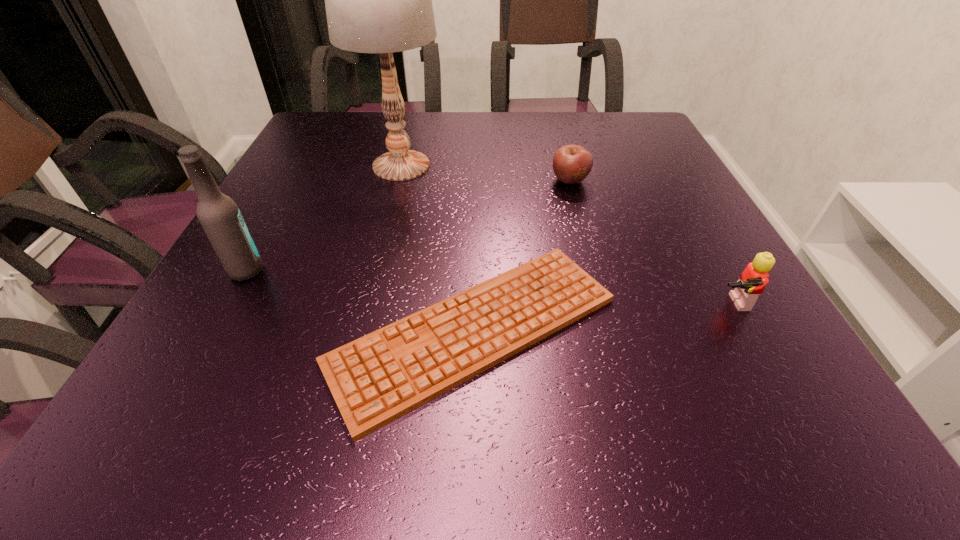
Locate an element on the screen. free area in between the lamp and the shortest object is located at coordinates (438, 248).

In order to click on object that ranks as the closest to the third shortest object in this screenshot , I will do `click(380, 377)`.

Locate an element on the screen. Image resolution: width=960 pixels, height=540 pixels. object that is the third closest to the shortest object is located at coordinates (572, 163).

I want to click on vacant space that satisfies the following two spatial constraints: 1. on the side of the fourth tallest object with the unique marking; 2. on the side of the leftmost object with the label, so click(x=594, y=271).

The height and width of the screenshot is (540, 960). Identify the location of vacant space that satisfies the following two spatial constraints: 1. on the front side of the lamp; 2. on the left side of the shortest object. (x=360, y=330).

I want to click on vacant region that satisfies the following two spatial constraints: 1. on the side of the second shortest object with the unique marking; 2. on the side of the second tallest object with the label, so click(x=594, y=271).